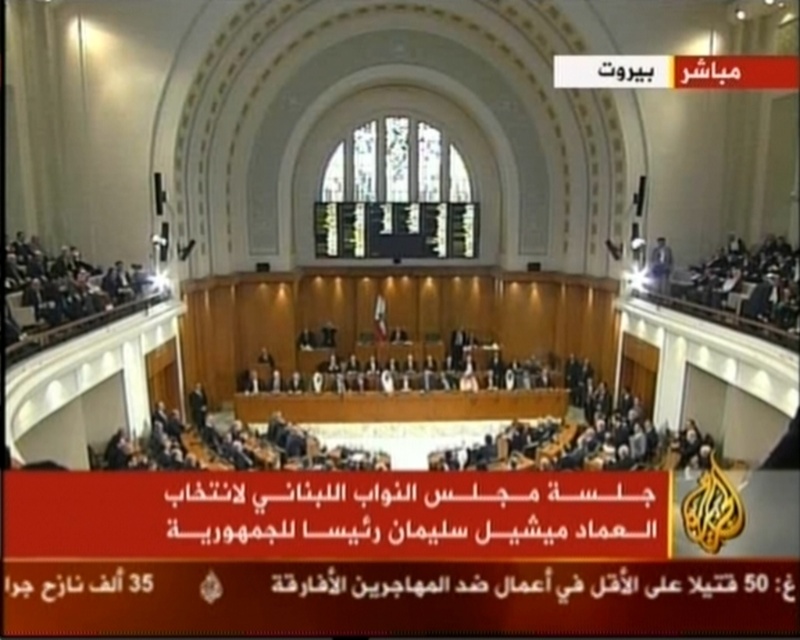
You are attending a meeting in this hall and need to sit down. There is a dark brown wooden chair at upper left and a white glossy microphone at upper center. Which object should you approach first to reach the chair?

You should approach the dark brown wooden chair at upper left first because it is located below the white glossy microphone at upper center, meaning it is closer to the floor level and easier to access.

You are an event photographer positioned at the back of the hall. You need to capture a clear shot of the white glossy microphone at upper center without any obstruction from the dark brown wooden chair at upper left. Is this possible based on their positions?

The dark brown wooden chair at upper left is taller than the white glossy microphone at upper center, so the chair may obstruct the view of the microphone. Adjust your position to ensure the microphone is visible above or around the chair.